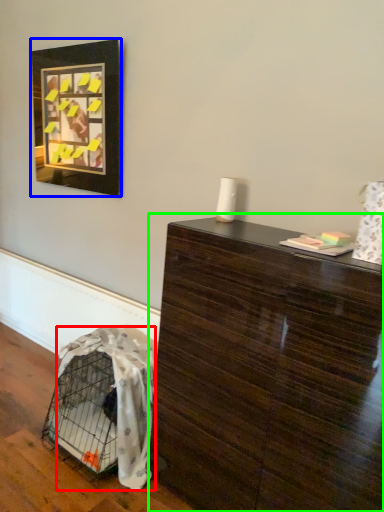
Question: Which is farther away from blanket (highlighted by a red box)? picture frame (highlighted by a blue box) or table (highlighted by a green box)?

Choices:
 (A) picture frame
 (B) table

Answer: (A)